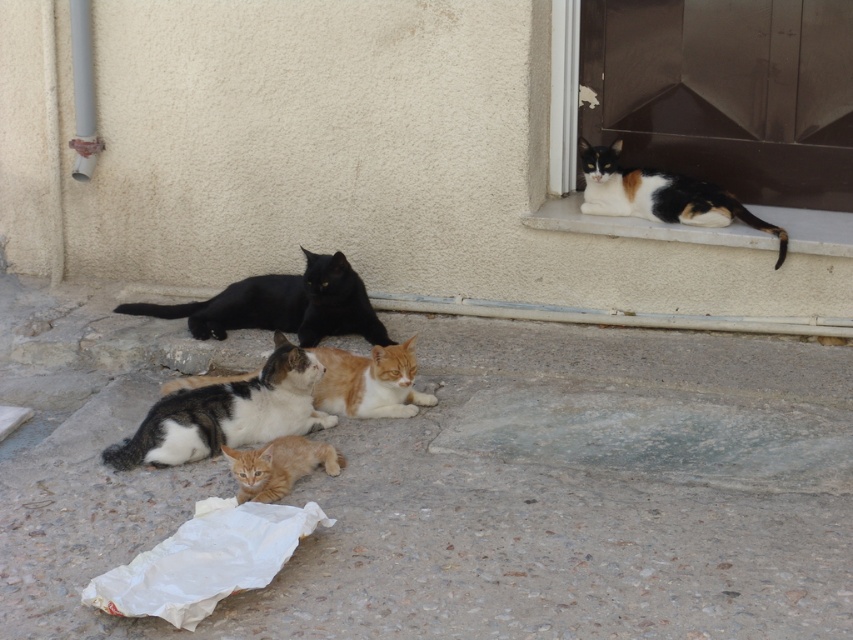
The width and height of the screenshot is (853, 640). What do you see at coordinates (724, 92) in the screenshot? I see `metallic door at upper right` at bounding box center [724, 92].

Between metallic door at upper right and black matte cat at center, which one is positioned lower?

black matte cat at center is lower down.

Identify the location of metallic door at upper right. Image resolution: width=853 pixels, height=640 pixels. (724, 92).

Is calico fur cat at center closer to the viewer compared to calico fur cat at upper right?

That is True.

Looking at this image, is calico fur cat at center bigger than calico fur cat at upper right?

Incorrect, calico fur cat at center is not larger than calico fur cat at upper right.

Does point (270, 397) come farther from viewer compared to point (706, 195)?

That is False.

Find the location of a particular element. calico fur cat at center is located at coordinates (227, 413).

Which is behind, point (606, 150) or point (233, 456)?

The point (606, 150) is more distant.

Who is positioned more to the right, calico fur cat at upper right or orange fur cat at lower center?

calico fur cat at upper right

Does point (584, 148) lie behind point (328, 465)?

Yes, point (584, 148) is behind point (328, 465).

At what (x,y) coordinates should I click in order to perform the action: click on calico fur cat at upper right. Please return your answer as a coordinate pair (x, y). The height and width of the screenshot is (640, 853). Looking at the image, I should click on (660, 195).